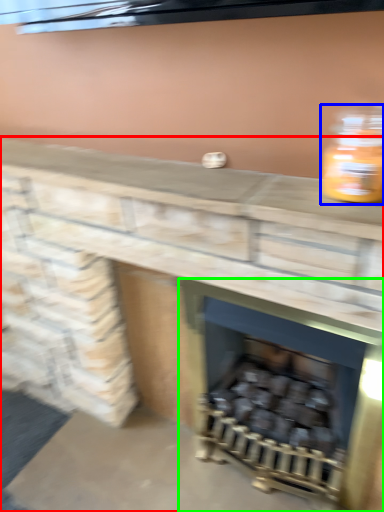
Question: Which object is positioned farthest from fireplace (highlighted by a red box)? Select from bottle (highlighted by a blue box) and wood burning stove (highlighted by a green box).

Choices:
 (A) bottle
 (B) wood burning stove

Answer: (A)